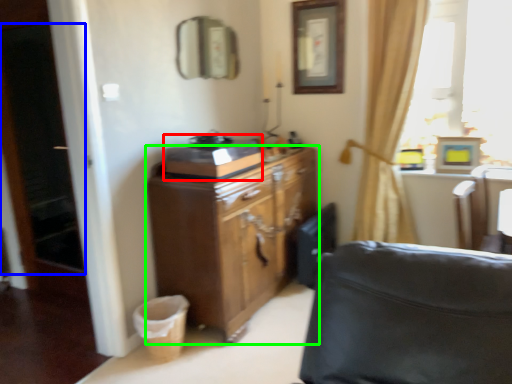
Question: Based on their relative distances, which object is nearer to appliance (highlighted by a red box)? Choose from screen door (highlighted by a blue box) and cabinetry (highlighted by a green box).

Choices:
 (A) screen door
 (B) cabinetry

Answer: (B)